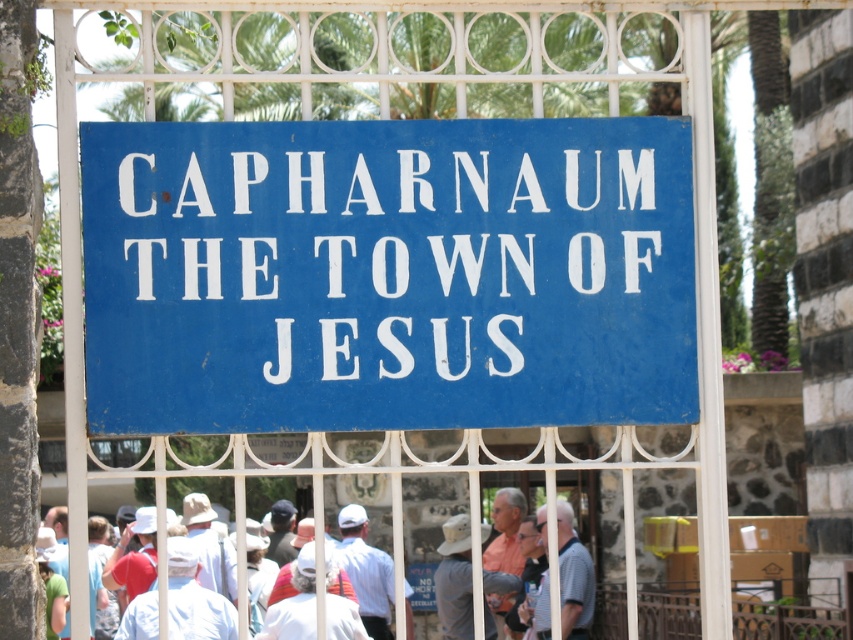
You are a tour guide standing in front of the blue sign with white text. You notice two tourists wearing a light blue shirt at center and a white cotton shirt at center. If you want to hand out a brochure to both tourists without moving from your position, can you reach both of them if your arms can extend 1 meter each?

The light blue shirt at center is 1.04 meters from the white cotton shirt at center. Since your arms can only extend 1 meter each, you cannot reach both tourists simultaneously without moving from your position.

You are a photographer trying to capture both the light blue shirt at center and the white cotton shirt at center in a single frame. Which shirt should you focus on first to ensure both are in the frame?

The light blue shirt at center is smaller than the white cotton shirt at center, so you should focus on the white cotton shirt at center first to ensure both are in the frame.

You are a tour guide standing near the fence. You need to hand out a pamphlet to a tourist wearing the light blue shirt at center. The pamphlet is about the blue painted metal sign at center. Can you reach the tourist without leaving your current position near the fence?

The blue painted metal sign at center and light blue shirt at center are 119.81 feet apart from each other. Since you are near the fence where the sign is mounted, you are approximately 119.81 feet away from the tourist. This distance is too far to reach them without moving closer.